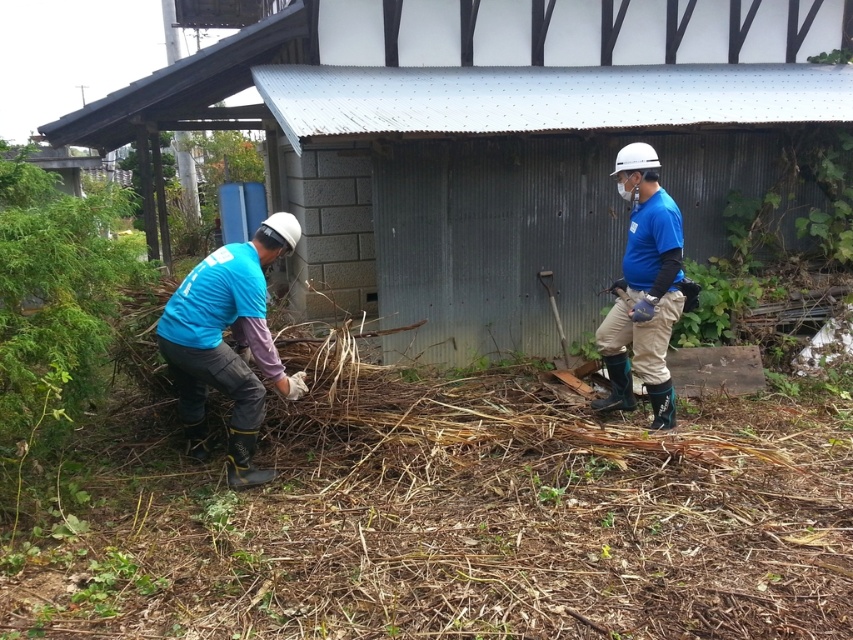
Is matte blue shirt at left closer to the viewer compared to blue fabric shirt at right?

Yes, it is in front of blue fabric shirt at right.

The width and height of the screenshot is (853, 640). What do you see at coordinates (227, 344) in the screenshot?
I see `matte blue shirt at left` at bounding box center [227, 344].

Which is behind, point (223, 292) or point (648, 232)?

Point (648, 232)

At what (x,y) coordinates should I click in order to perform the action: click on matte blue shirt at left. Please return your answer as a coordinate pair (x, y). Looking at the image, I should click on [x=227, y=344].

Is point (601, 241) closer to viewer compared to point (663, 241)?

No, it is behind (663, 241).

You are a GUI agent. You are given a task and a screenshot of the screen. Output one action in this format:
    pyautogui.click(x=<x>, y=<y>)
    Task: Click on the blue fabric hut at center
    This screenshot has width=853, height=640.
    Given the screenshot: What is the action you would take?
    pyautogui.click(x=491, y=141)

Find the location of `blue fabric hut at center`. blue fabric hut at center is located at coordinates (491, 141).

Does blue fabric hut at center appear under matte blue shirt at left?

No.

Where is `blue fabric hut at center`? blue fabric hut at center is located at coordinates (491, 141).